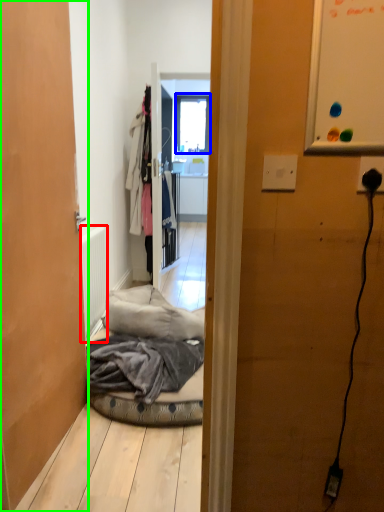
Question: Which is farther away from radiator (highlighted by a red box)? window (highlighted by a blue box) or door (highlighted by a green box)?

Choices:
 (A) window
 (B) door

Answer: (A)